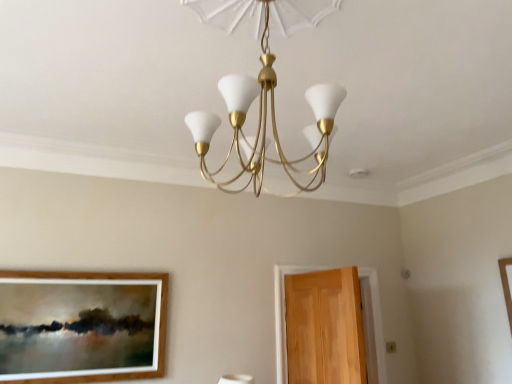
This screenshot has width=512, height=384. Describe the element at coordinates (264, 89) in the screenshot. I see `gold metallic chandelier at center` at that location.

Find the location of a particular element. gold metallic chandelier at center is located at coordinates (264, 89).

The image size is (512, 384). I want to click on gold metallic chandelier at center, so click(x=264, y=89).